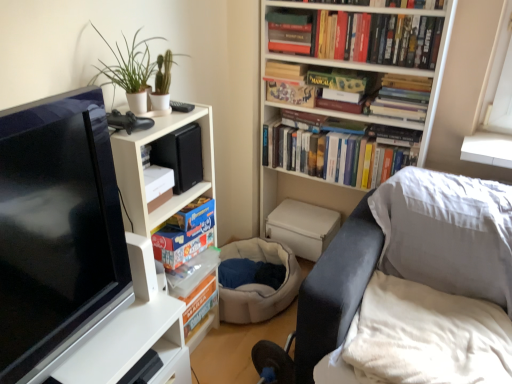
This screenshot has width=512, height=384. Find the location of `vacant space situated above hardcover book at upper center, acting as the 6th book starting from the bottom (from a real-world perspective)`. vacant space situated above hardcover book at upper center, acting as the 6th book starting from the bottom (from a real-world perspective) is located at coordinates 291,8.